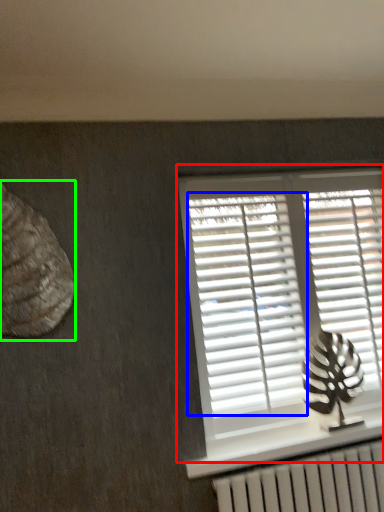
Question: Considering the real-world distances, which object is closest to window (highlighted by a red box)? shutter (highlighted by a blue box) or animal (highlighted by a green box).

Choices:
 (A) shutter
 (B) animal

Answer: (A)